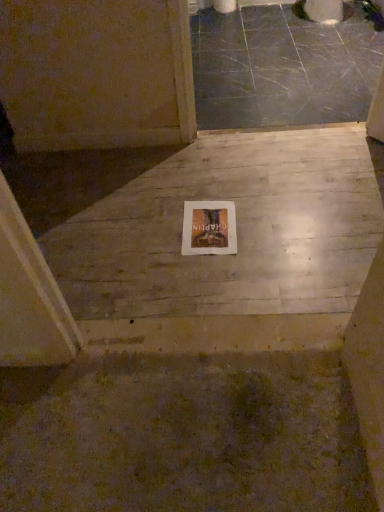
Question: Is white wood floor at center, which is the 2th concrete from back to front, turned away from wooden book at center?

Choices:
 (A) no
 (B) yes

Answer: (B)

Question: From a real-world perspective, is white wood floor at center, which is the first concrete from front to back, positioned under wooden book at center based on gravity?

Choices:
 (A) no
 (B) yes

Answer: (B)

Question: Considering the relative sizes of white wood floor at center, which is the first concrete from front to back, and wooden book at center in the image provided, is white wood floor at center, which is the first concrete from front to back, thinner than wooden book at center?

Choices:
 (A) yes
 (B) no

Answer: (B)

Question: Can you confirm if white wood floor at center, which is the 2th concrete from back to front, is wider than wooden book at center?

Choices:
 (A) yes
 (B) no

Answer: (A)

Question: Is white wood floor at center, positioned as the 2th concrete in top-to-bottom order, closer to camera compared to wooden book at center?

Choices:
 (A) no
 (B) yes

Answer: (B)

Question: Based on their positions, is wooden book at center located to the left or right of white wood floor at center, which is the first concrete from front to back?

Choices:
 (A) right
 (B) left

Answer: (A)

Question: From the image's perspective, is wooden book at center positioned above or below white wood floor at center, which is the 2th concrete from back to front?

Choices:
 (A) above
 (B) below

Answer: (B)

Question: In the image, is wooden book at center positioned in front of or behind white wood floor at center, which is the 2th concrete from back to front?

Choices:
 (A) front
 (B) behind

Answer: (B)

Question: Considering the positions of wooden book at center and white wood floor at center, the first concrete from the bottom, in the image, is wooden book at center wider or thinner than white wood floor at center, the first concrete from the bottom,?

Choices:
 (A) wide
 (B) thin

Answer: (B)

Question: In terms of height, does wooden book at center look taller or shorter compared to gray polished concrete at upper center, the 2th concrete when ordered from bottom to top?

Choices:
 (A) tall
 (B) short

Answer: (B)

Question: Is wooden book at center bigger or smaller than gray polished concrete at upper center, which is counted as the 2th concrete, starting from the front?

Choices:
 (A) big
 (B) small

Answer: (B)

Question: Is wooden book at center in front of or behind gray polished concrete at upper center, the 1th concrete from the back, in the image?

Choices:
 (A) front
 (B) behind

Answer: (A)

Question: Is point (226, 201) positioned closer to the camera than point (306, 67)?

Choices:
 (A) closer
 (B) farther

Answer: (A)

Question: Looking at the image, does gray polished concrete at upper center, the 2th concrete when ordered from bottom to top, seem bigger or smaller compared to wooden book at center?

Choices:
 (A) small
 (B) big

Answer: (B)

Question: From the image's perspective, relative to wooden book at center, is gray polished concrete at upper center, which is counted as the 2th concrete, starting from the front, above or below?

Choices:
 (A) below
 (B) above

Answer: (B)